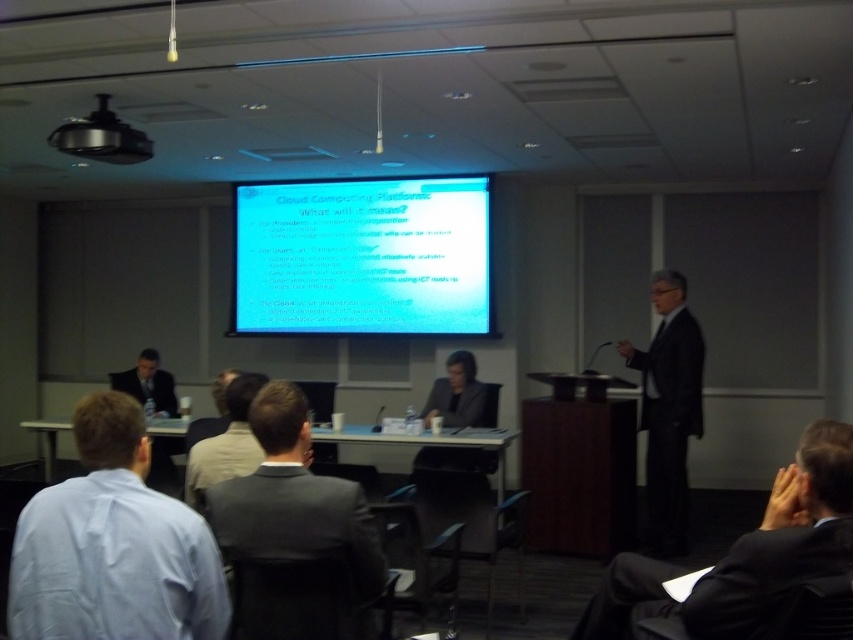
Between white glossy projector screen at upper center and black fabric business suit at center, which one is positioned lower?

Positioned lower is black fabric business suit at center.

In the scene shown: Who is more forward, [421,193] or [428,410]?

Point [428,410] is in front.

This screenshot has width=853, height=640. I want to click on white glossy projector screen at upper center, so click(x=361, y=257).

Is point (200, 452) positioned in front of point (434, 385)?

Yes, it is.

Where is `light brown shirt at center`? The height and width of the screenshot is (640, 853). light brown shirt at center is located at coordinates (225, 444).

Between light blue shirt at lower left and light brown suit at center, which one appears on the right side from the viewer's perspective?

From the viewer's perspective, light blue shirt at lower left appears more on the right side.

Is point (51, 499) positioned in front of point (189, 433)?

That is True.

The width and height of the screenshot is (853, 640). What are the coordinates of `light blue shirt at lower left` in the screenshot? It's located at (113, 545).